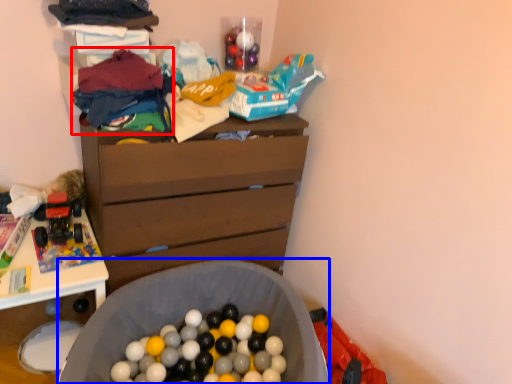
Question: Which point is closer to the camera, clothing (highlighted by a red box) or laundry basket (highlighted by a blue box)?

Choices:
 (A) clothing
 (B) laundry basket

Answer: (B)